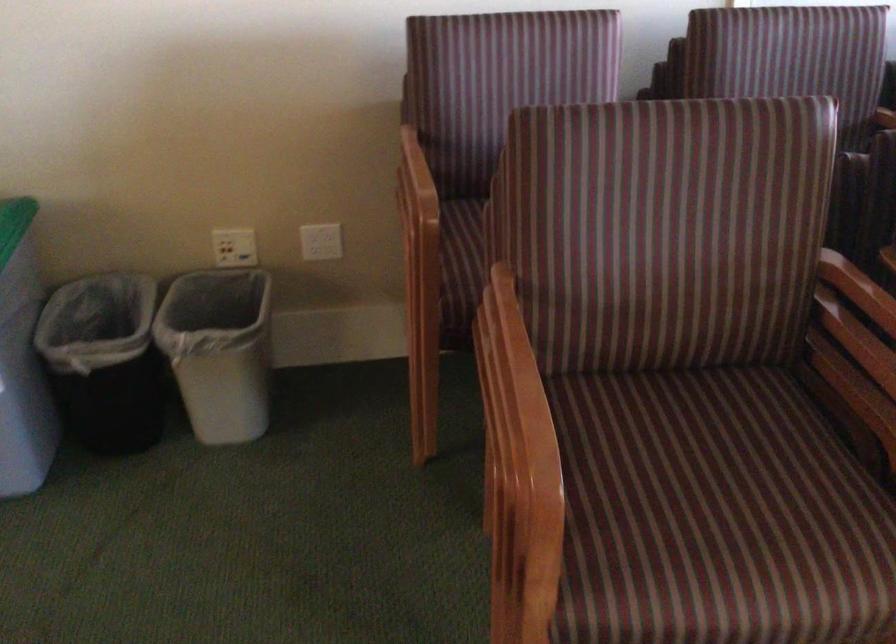
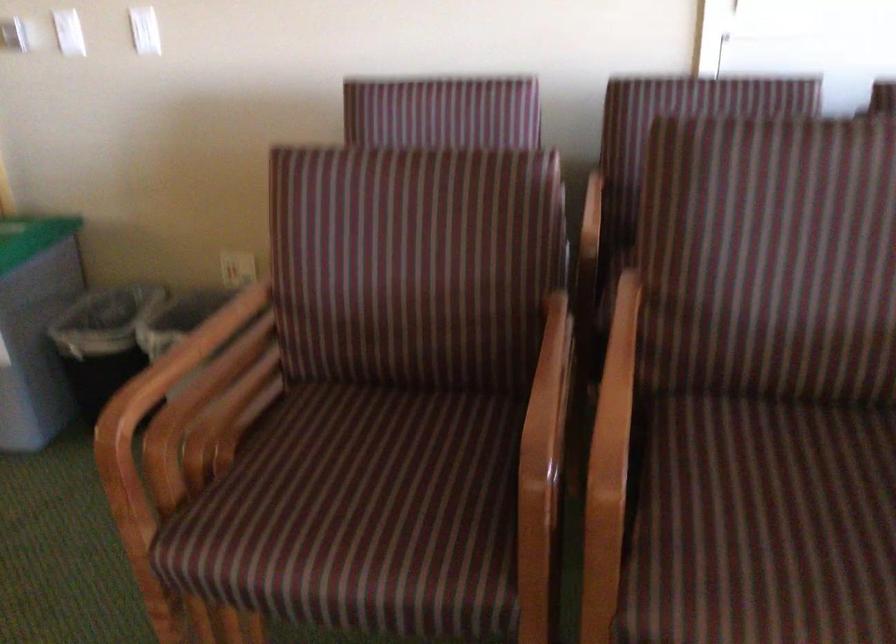
Question: How did the camera likely rotate?

Choices:
 (A) Left
 (B) Right
 (C) Up
 (D) Down

Answer: (A)